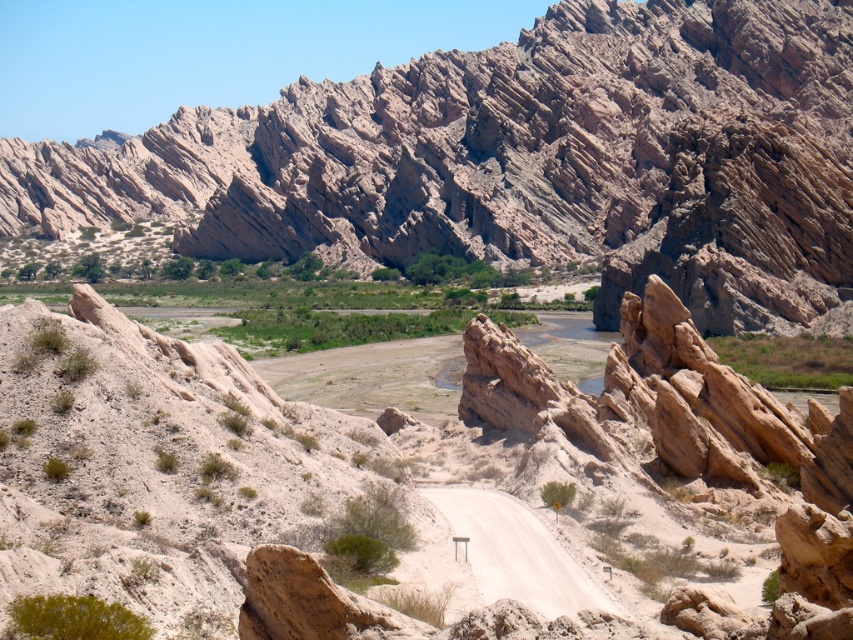
Question: Which object is closer to the camera taking this photo?

Choices:
 (A) rustic rock formation at upper center
 (B) white sandy dirt road at center

Answer: (B)

Question: Which point appears closest to the camera in this image?

Choices:
 (A) (462, 170)
 (B) (529, 525)

Answer: (B)

Question: Is rustic rock formation at upper center further to camera compared to white sandy dirt road at center?

Choices:
 (A) yes
 (B) no

Answer: (A)

Question: Can you confirm if rustic rock formation at upper center is wider than white sandy dirt road at center?

Choices:
 (A) no
 (B) yes

Answer: (B)

Question: Is rustic rock formation at upper center to the left of white sandy dirt road at center from the viewer's perspective?

Choices:
 (A) yes
 (B) no

Answer: (A)